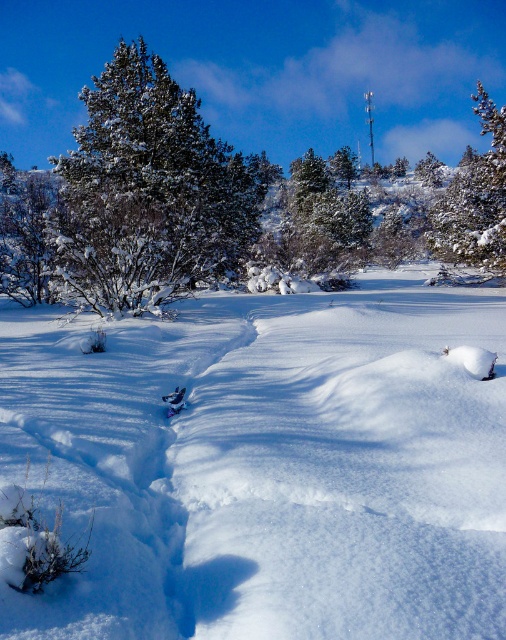
You are standing at the origin point in the winter landscape. Which direction should you move to reach the white fluffy snow at center?

The white fluffy snow at center is located at coordinates point (268, 467), so you should move towards the right and forward to reach it.

You are an observer standing in the winter landscape. You see the white fluffy snow at center and the green textured pine at upper right. Which object is closer to you?

The white fluffy snow at center is closer to you because it is in front of the green textured pine at upper right.